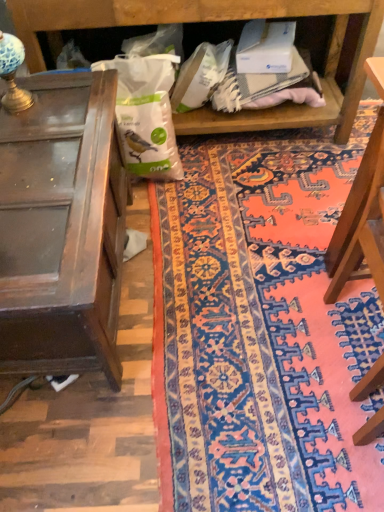
At what (x,y) coordinates should I click in order to perform the action: click on vacant space in wooden chair at right (from a real-world perspective). Please return your answer as a coordinate pair (x, y). The height and width of the screenshot is (512, 384). Looking at the image, I should click on [x=343, y=337].